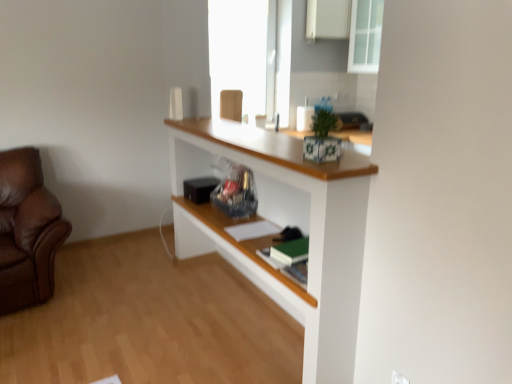
Question: Considering the relative positions of transparent glass cabinet at upper right and white painted wood shelf at center in the image provided, is transparent glass cabinet at upper right to the left or to the right of white painted wood shelf at center?

Choices:
 (A) right
 (B) left

Answer: (A)

Question: From a real-world perspective, is transparent glass cabinet at upper right above or below white painted wood shelf at center?

Choices:
 (A) below
 (B) above

Answer: (B)

Question: Which is nearer to the white matte cabinet at upper center?

Choices:
 (A) white plastic electric outlet at lower right
 (B) white matte book at center, the 1th book from the top
 (C) green matte book at center, which appears as the second book when viewed from the top
 (D) white painted wood shelf at center
 (E) transparent glass cabinet at upper right

Answer: (E)

Question: Estimate the real-world distances between objects in this image. Which object is closer to the white plastic electric outlet at lower right?

Choices:
 (A) white painted wood shelf at center
 (B) white matte book at center, which ranks as the 2th book in front-to-back order
 (C) green matte book at center, acting as the 2th book starting from the back
 (D) transparent glass cabinet at upper right
 (E) white matte cabinet at upper center

Answer: (C)